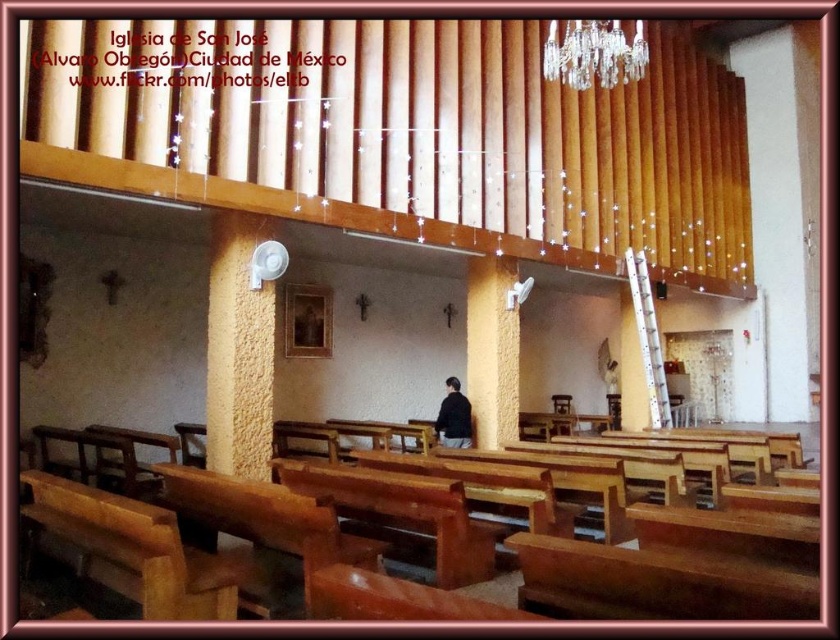
You are a visitor standing in the Iglesia de San Jose and want to take a photo of the clear crystal chandelier at upper center and the white metallic ladder at right. Which object will appear larger in your photo?

The clear crystal chandelier at upper center will appear larger in the photo because it is closer to the viewer than the white metallic ladder at right.

You are standing in the Iglesia de San Jose and want to take a photo of the clear crystal chandelier at upper center. If your camera is 20.84 feet away from the chandelier, is it within the recommended 25 feet range for clear photos?

The clear crystal chandelier at upper center and camera are 20.84 feet apart, which is within the recommended 25 feet range for clear photos.

From the picture: You are a maintenance worker in Iglesia de San Jose. You need to reach the clear crystal chandelier at upper center to clean it. The white metallic ladder at right is available. Can you use the ladder to reach the chandelier?

The clear crystal chandelier at upper center is to the left of white metallic ladder at right, so the ladder is positioned to the right of the chandelier. Since the ladder is not directly under the chandelier, you may need to move it to the left to reach it properly.